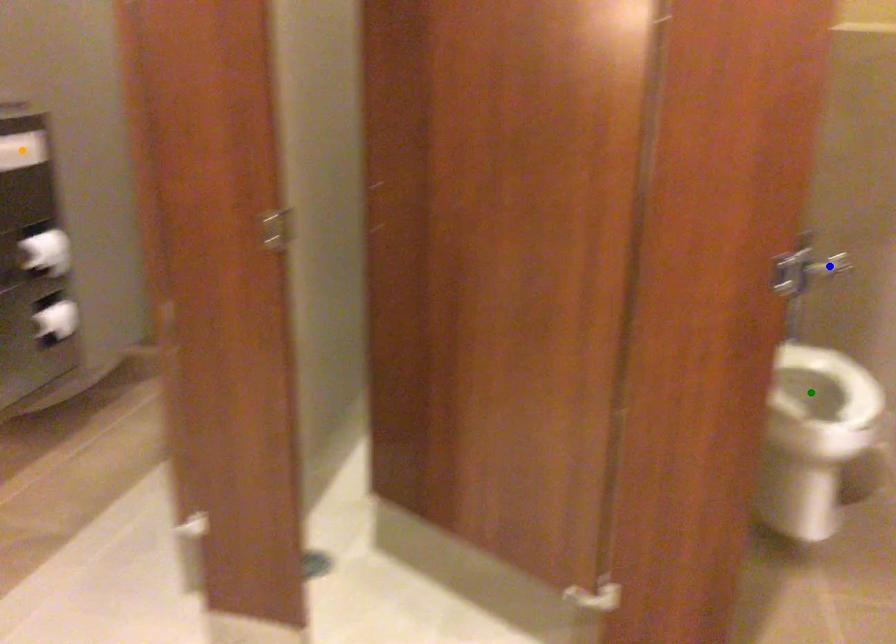
Order these from nearest to farthest:
- orange point
- green point
- blue point

green point, orange point, blue point